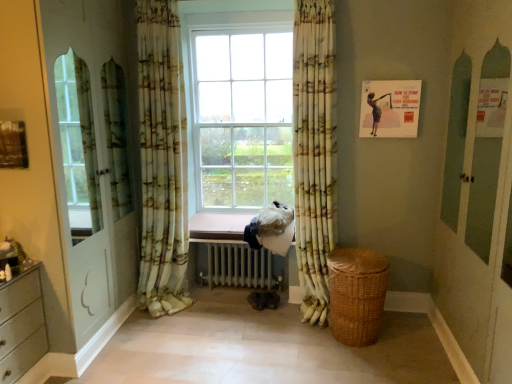
Question: Is yellow-green floral fabric curtain at center, the second curtain when ordered from left to right, in front of or behind white metallic radiator at center in the image?

Choices:
 (A) behind
 (B) front

Answer: (B)

Question: Is yellow-green floral fabric curtain at center, positioned as the 1th curtain in right-to-left order, inside the boundaries of white metallic radiator at center, or outside?

Choices:
 (A) outside
 (B) inside

Answer: (A)

Question: Considering the real-world distances, which object is closest to the pink wood at center?

Choices:
 (A) woven brown basket at lower right
 (B) white metallic radiator at center
 (C) yellow-green floral fabric curtain at center, the second curtain when ordered from left to right
 (D) printed fabric curtain at left, the 1th curtain in the left-to-right sequence
 (E) matte paper poster at upper right

Answer: (B)

Question: Considering the real-world distances, which object is closest to the matte paper poster at upper right?

Choices:
 (A) pink wood at center
 (B) yellow-green floral fabric curtain at center, positioned as the 1th curtain in right-to-left order
 (C) printed fabric curtain at left, the 1th curtain in the left-to-right sequence
 (D) white metallic radiator at center
 (E) woven brown basket at lower right

Answer: (B)